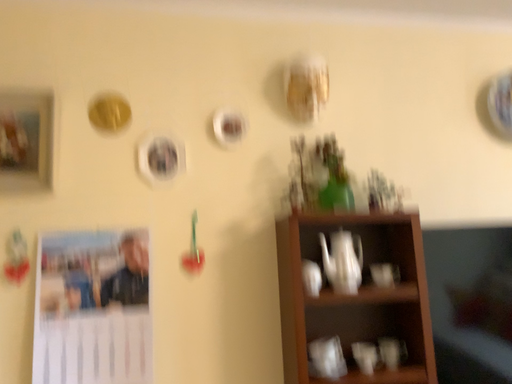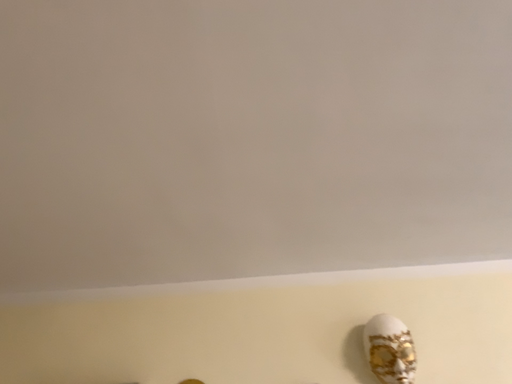
Question: Which way did the camera rotate in the video?

Choices:
 (A) rotated left
 (B) rotated right

Answer: (A)